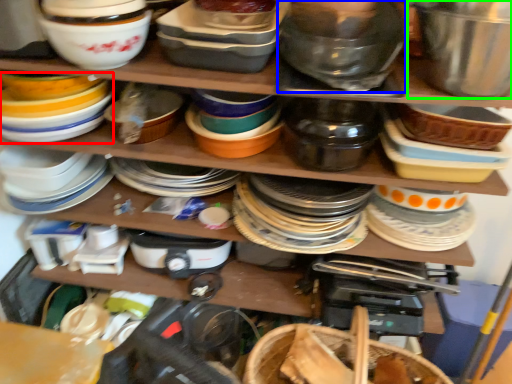
Question: Which object is positioned closest to appliance (highlighted by a red box)? Select from bowl (highlighted by a blue box) and bowl (highlighted by a green box).

Choices:
 (A) bowl
 (B) bowl

Answer: (A)